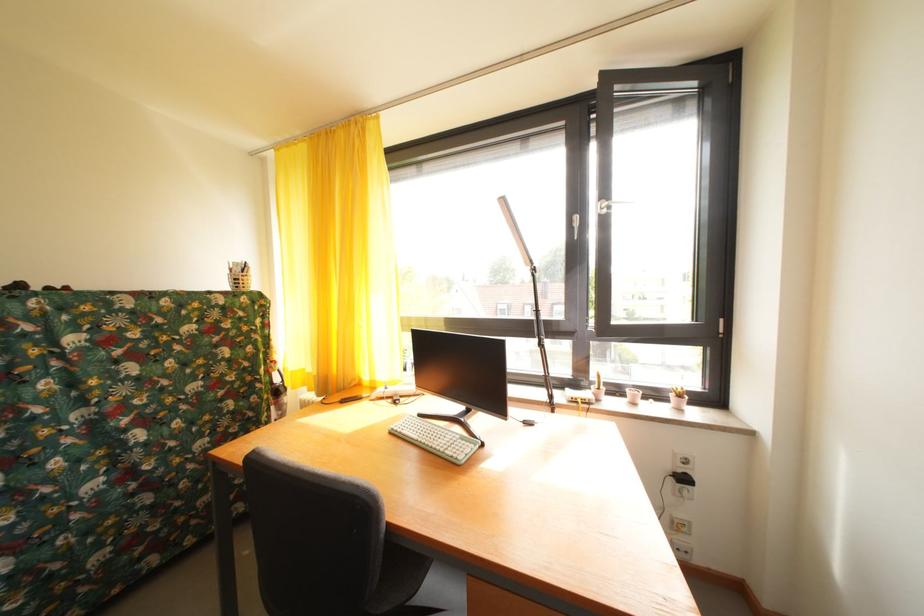
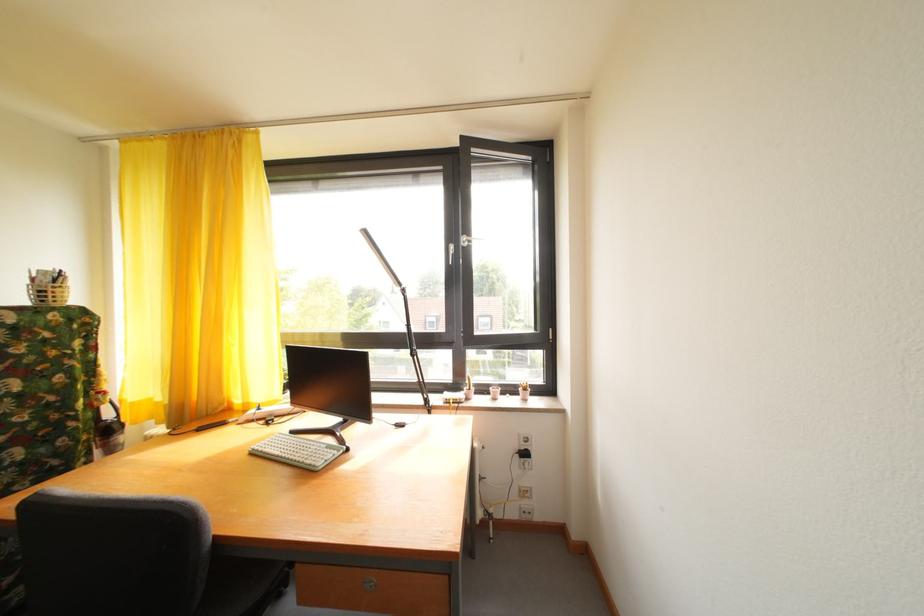
Locate, in the second image, the point that corresponds to pixel 625 397 in the first image.

(492, 395)